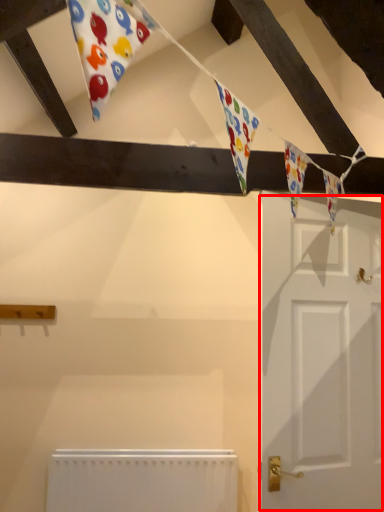
Question: Where is door (annotated by the red box) located in relation to radiator in the image?

Choices:
 (A) left
 (B) right

Answer: (B)